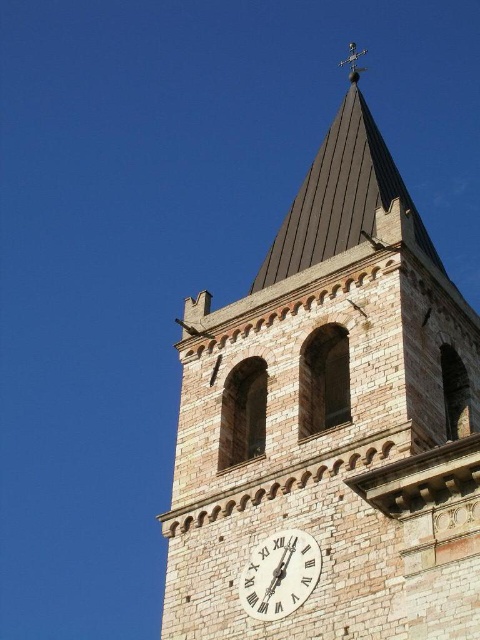
Question: Considering the relative positions of brown stone clock tower at upper center and white stone clock at center in the image provided, where is brown stone clock tower at upper center located with respect to white stone clock at center?

Choices:
 (A) below
 (B) above

Answer: (B)

Question: Is brown stone clock tower at upper center thinner than white stone clock at center?

Choices:
 (A) no
 (B) yes

Answer: (A)

Question: Among these points, which one is farthest from the camera?

Choices:
 (A) (272, 561)
 (B) (288, 465)

Answer: (B)

Question: Which point appears farthest from the camera in this image?

Choices:
 (A) (192, 556)
 (B) (313, 561)

Answer: (A)

Question: Does brown stone clock tower at upper center appear under white stone clock at center?

Choices:
 (A) yes
 (B) no

Answer: (B)